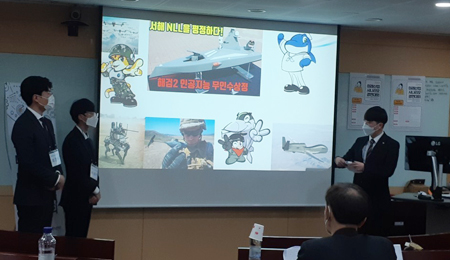
In order to click on projected image in this screenshot , I will do `click(276, 99)`.